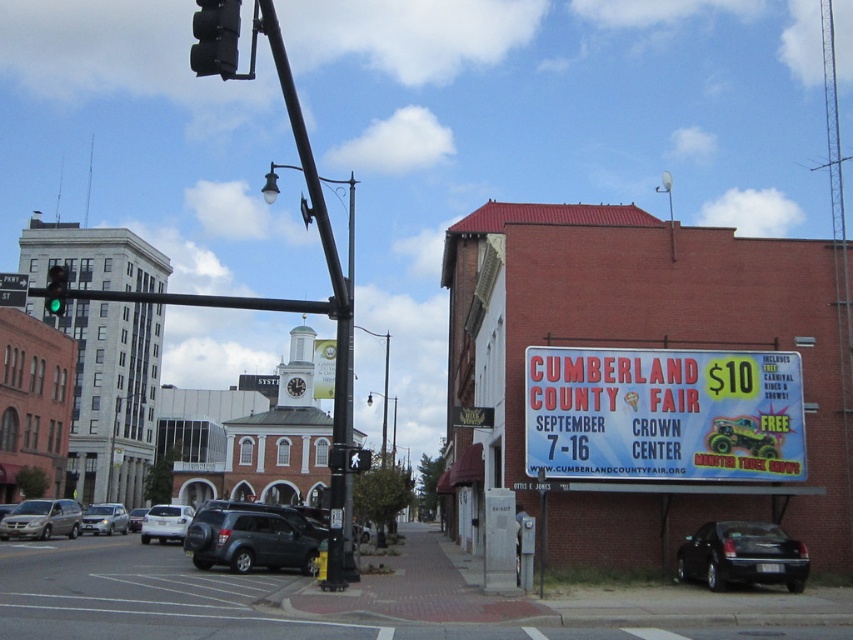
Question: Is matte black suv at center wider than green matte pedestrian signal at center?

Choices:
 (A) no
 (B) yes

Answer: (A)

Question: Observing the image, what is the correct spatial positioning of white matte sedan at center in reference to silver metallic sedan at center-left?

Choices:
 (A) below
 (B) above

Answer: (B)

Question: Observing the image, what is the correct spatial positioning of matte black suv at center in reference to silver metallic suv at center?

Choices:
 (A) right
 (B) left

Answer: (A)

Question: Estimate the real-world distances between objects in this image. Which object is farther from the silver metallic minivan at lower left?

Choices:
 (A) matte black suv at center
 (B) white matte sedan at center
 (C) silver metallic suv at center
 (D) black glass traffic light at upper center

Answer: (D)

Question: Among these points, which one is nearest to the camera?

Choices:
 (A) (54, 292)
 (B) (234, 10)
 (C) (183, 522)
 (D) (606, 420)

Answer: (B)

Question: Estimate the real-world distances between objects in this image. Which object is closer to the green matte pedestrian signal at center?

Choices:
 (A) silver metallic suv at center
 (B) black matte sedan at lower right
 (C) matte black suv at center

Answer: (C)